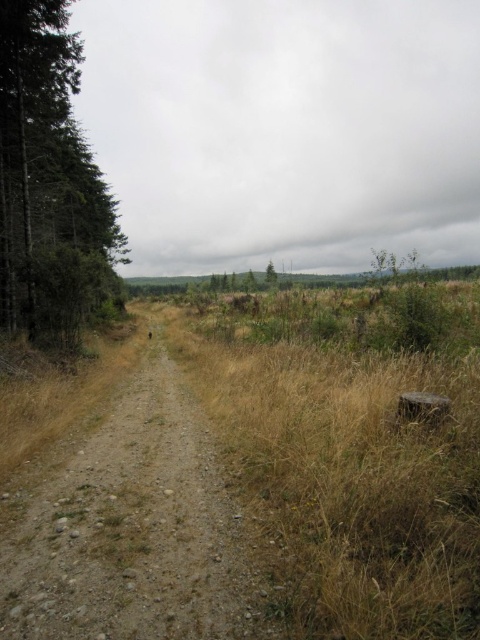
Question: Can you confirm if dry grass at center is positioned below dark green textured tree at left?

Choices:
 (A) yes
 (B) no

Answer: (A)

Question: Which of these objects is positioned closest to the dark green textured tree at left?

Choices:
 (A) dirt/gravel trail at center
 (B) dry grass at center
 (C) green matte tree at center

Answer: (A)

Question: Which object is the closest to the dark green textured tree at left?

Choices:
 (A) dry grass at center
 (B) dirt/gravel trail at center
 (C) green matte tree at center

Answer: (B)

Question: Can you confirm if dry grass at center is wider than green matte tree at center?

Choices:
 (A) no
 (B) yes

Answer: (A)

Question: Which point is closer to the camera?

Choices:
 (A) dark green textured tree at left
 (B) dirt/gravel trail at center

Answer: (B)

Question: Does dry grass at center have a larger size compared to dirt/gravel trail at center?

Choices:
 (A) yes
 (B) no

Answer: (A)